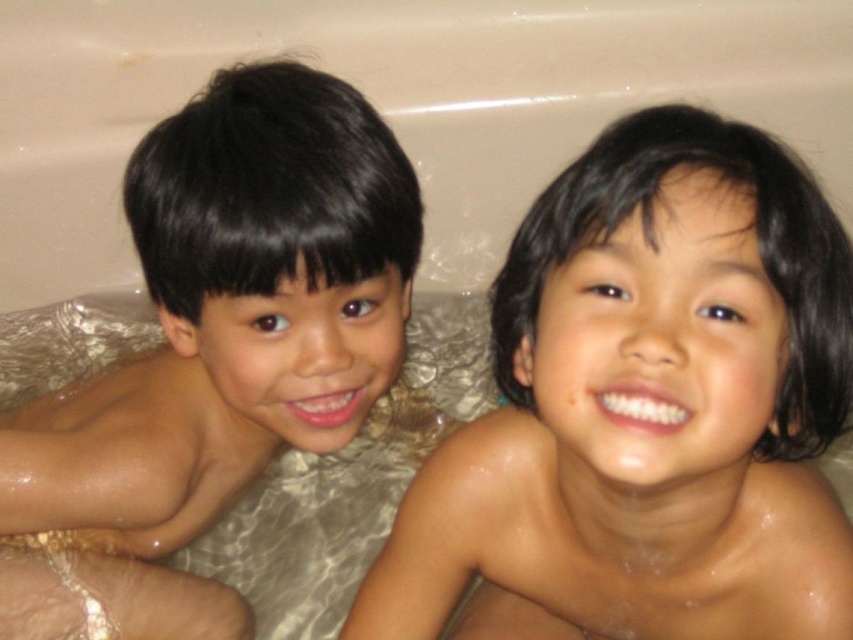
You are a photographer taking a picture of the dry skin child at center and the brown matte skin at left. Which child should you focus on first to ensure both are in clear focus?

You should focus on the dry skin child at center first because it is closer to the viewer than the brown matte skin at left, so focusing on the closer child ensures both will be in focus when using depth of field techniques.

Based on the photo, you are a parent trying to apply lotion to your children. You see the dry skin child at center and the brown matte skin at left. Which child should you apply lotion to first based on their position?

You should apply lotion to the dry skin child at center first because they are positioned to the right of the brown matte skin at left, making them closer to you from your right side.